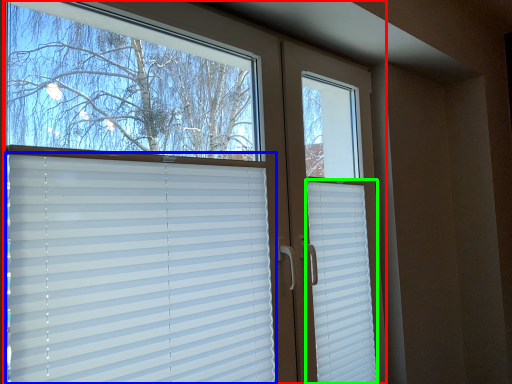
Question: Which object is the farthest from window (highlighted by a red box)? Choose among these: window blind (highlighted by a blue box) or shutter (highlighted by a green box).

Choices:
 (A) window blind
 (B) shutter

Answer: (B)